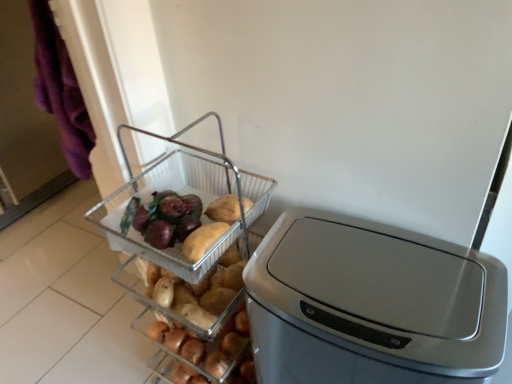
Question: Is clear plastic basket at center shorter than clear plastic basket at center?

Choices:
 (A) no
 (B) yes

Answer: (B)

Question: Can you confirm if clear plastic basket at center is smaller than clear plastic basket at center?

Choices:
 (A) yes
 (B) no

Answer: (A)

Question: From a real-world perspective, is clear plastic basket at center below clear plastic basket at center?

Choices:
 (A) no
 (B) yes

Answer: (A)

Question: Considering the relative sizes of clear plastic basket at center and clear plastic basket at center in the image provided, is clear plastic basket at center thinner than clear plastic basket at center?

Choices:
 (A) yes
 (B) no

Answer: (A)

Question: Can we say clear plastic basket at center lies outside clear plastic basket at center?

Choices:
 (A) no
 (B) yes

Answer: (A)

Question: In terms of size, does clear plastic basket at center appear bigger or smaller than clear plastic basket at center?

Choices:
 (A) big
 (B) small

Answer: (B)

Question: Considering the positions of clear plastic basket at center and clear plastic basket at center in the image, is clear plastic basket at center wider or thinner than clear plastic basket at center?

Choices:
 (A) thin
 (B) wide

Answer: (A)

Question: Is clear plastic basket at center in front of or behind clear plastic basket at center in the image?

Choices:
 (A) front
 (B) behind

Answer: (B)

Question: Is clear plastic basket at center taller or shorter than clear plastic basket at center?

Choices:
 (A) short
 (B) tall

Answer: (A)

Question: Would you say satin silver trash can at center is to the left or to the right of clear plastic basket at center in the picture?

Choices:
 (A) left
 (B) right

Answer: (B)

Question: Considering the positions of satin silver trash can at center and clear plastic basket at center in the image, is satin silver trash can at center bigger or smaller than clear plastic basket at center?

Choices:
 (A) big
 (B) small

Answer: (A)

Question: In terms of width, does satin silver trash can at center look wider or thinner when compared to clear plastic basket at center?

Choices:
 (A) wide
 (B) thin

Answer: (B)

Question: From a real-world perspective, is satin silver trash can at center positioned above or below clear plastic basket at center?

Choices:
 (A) above
 (B) below

Answer: (B)

Question: From the image's perspective, is clear plastic basket at center above or below satin silver trash can at center?

Choices:
 (A) below
 (B) above

Answer: (B)

Question: Would you say clear plastic basket at center is inside or outside satin silver trash can at center?

Choices:
 (A) outside
 (B) inside

Answer: (A)